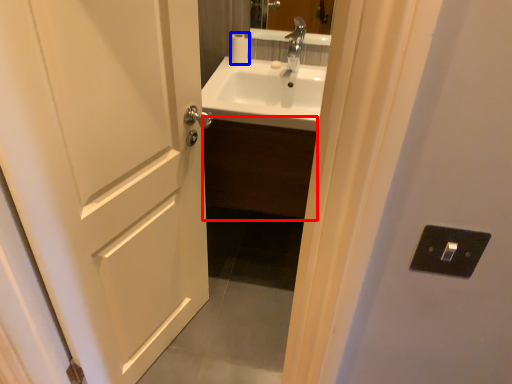
Question: Which of the following is the closest to the observer, cabinetry (highlighted by a red box) or toilet paper (highlighted by a blue box)?

Choices:
 (A) cabinetry
 (B) toilet paper

Answer: (A)